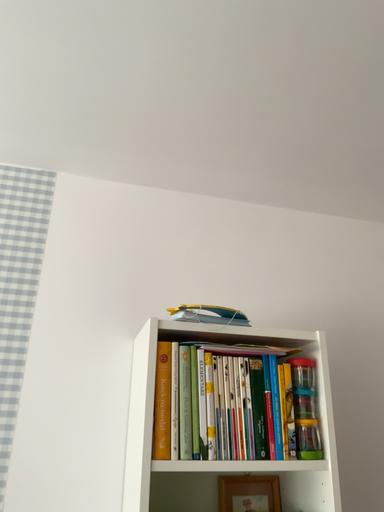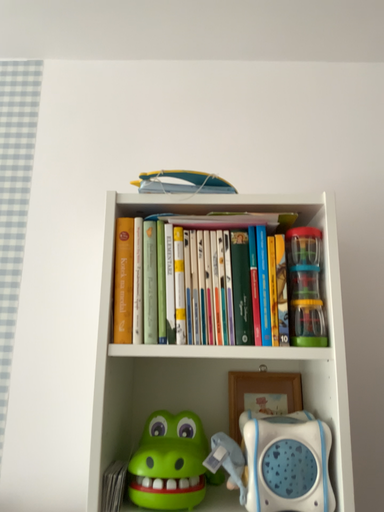
Question: Which way did the camera rotate in the video?

Choices:
 (A) rotated upward
 (B) rotated downward

Answer: (B)